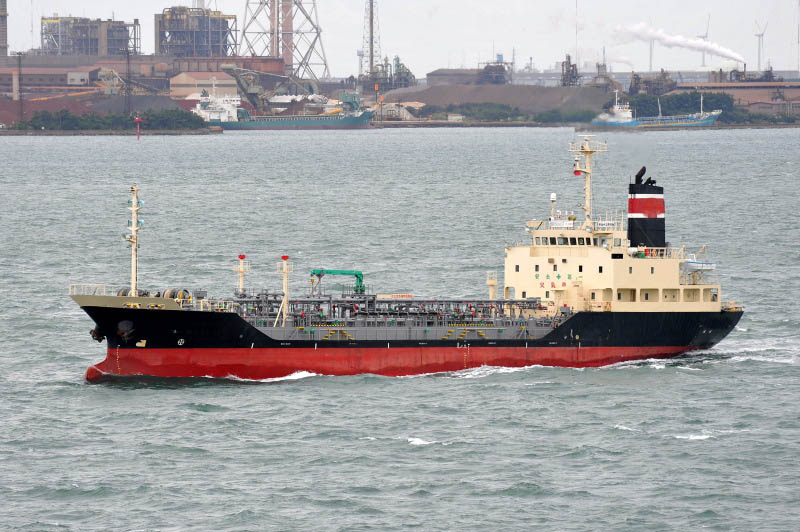
You are a GUI agent. You are given a task and a screenshot of the screen. Output one action in this format:
    pyautogui.click(x=<x>, y=<y>)
    Task: Click on the white trim
    Image resolution: width=800 pixels, height=532 pixels.
    Given the screenshot: What is the action you would take?
    pyautogui.click(x=638, y=215)